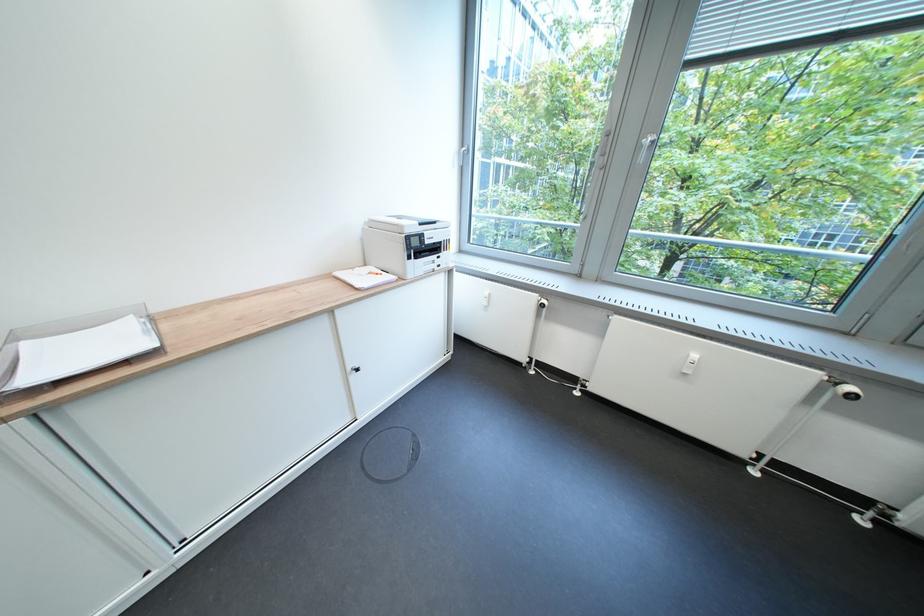
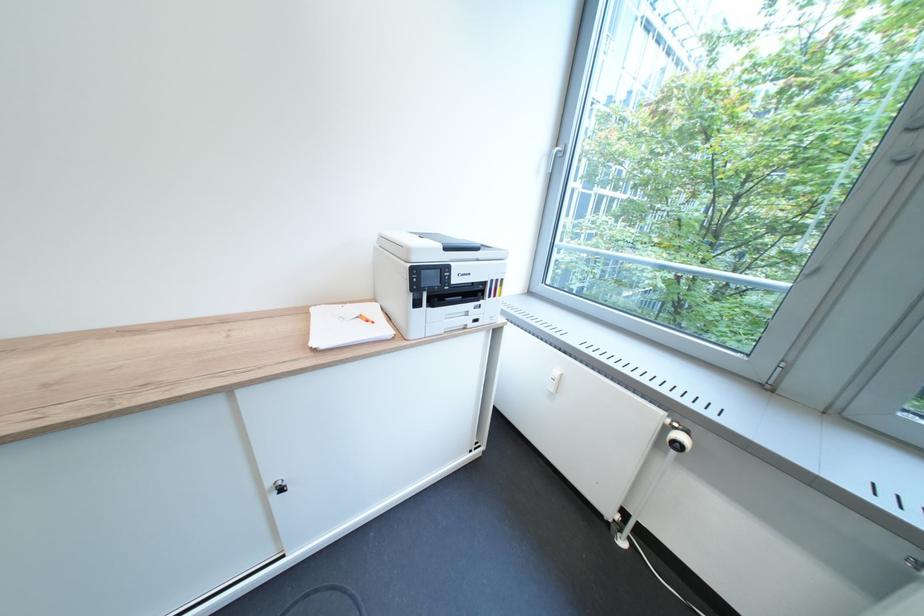
Question: The first image is from the beginning of the video and the second image is from the end. How did the camera likely rotate when shooting the video?

Choices:
 (A) Left
 (B) Right
 (C) Up
 (D) Down

Answer: (A)